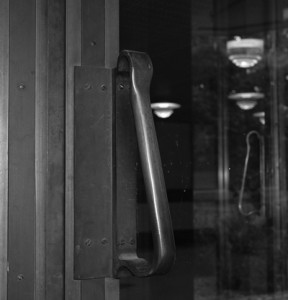
Locate an element on the screen. door is located at coordinates (85, 40).